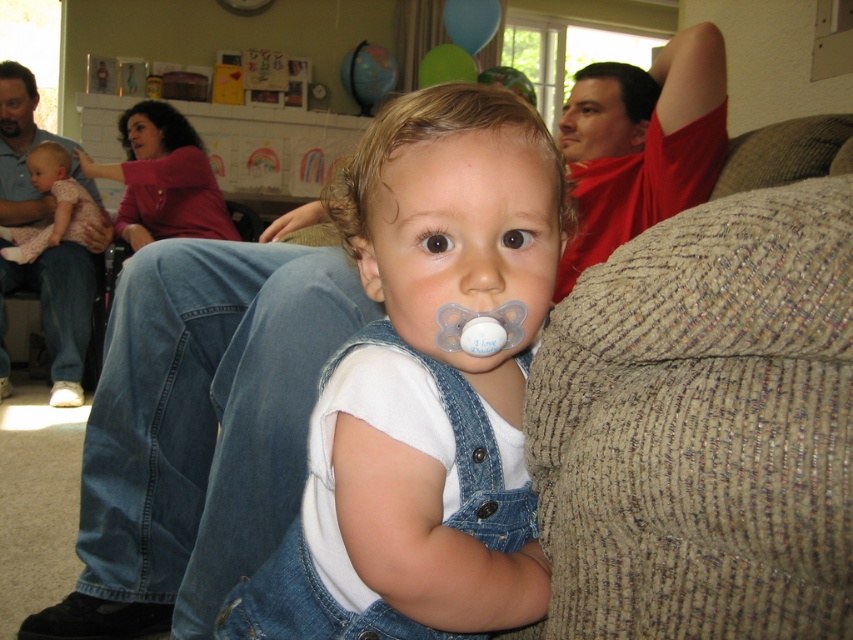
Question: Is denim overalls at center to the right of matte pink dress at left from the viewer's perspective?

Choices:
 (A) yes
 (B) no

Answer: (A)

Question: Which object is closer to the camera taking this photo?

Choices:
 (A) denim overalls at center
 (B) matte pink dress at left

Answer: (A)

Question: Among these points, which one is farthest from the camera?

Choices:
 (A) (532, 586)
 (B) (76, 212)

Answer: (B)

Question: Does denim overalls at center appear over matte pink dress at left?

Choices:
 (A) yes
 (B) no

Answer: (B)

Question: Which of the following is the farthest from the observer?

Choices:
 (A) denim overalls at center
 (B) matte pink dress at left

Answer: (B)

Question: Can you confirm if denim overalls at center is wider than matte pink dress at left?

Choices:
 (A) yes
 (B) no

Answer: (B)